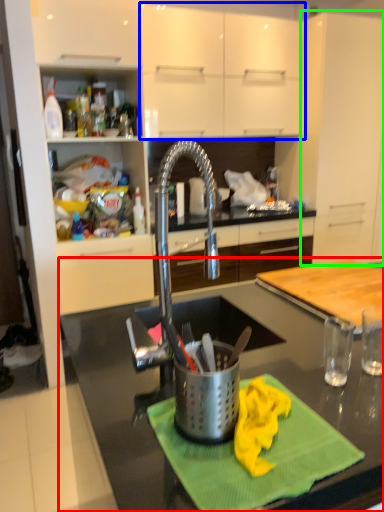
Question: Which is nearer to the countertop (highlighted by a red box)? cabinetry (highlighted by a blue box) or cabinetry (highlighted by a green box).

Choices:
 (A) cabinetry
 (B) cabinetry

Answer: (A)